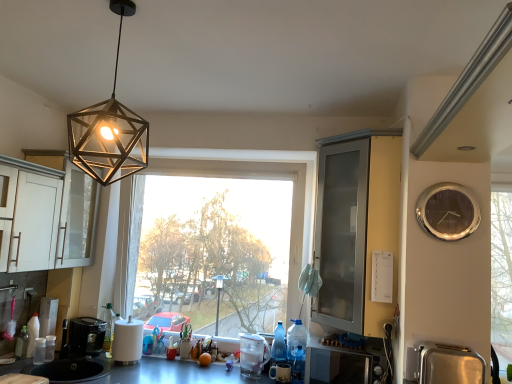
Question: Considering the relative positions of silver metallic clock at right and clear plastic blender at center, which is counted as the 3th appliance, starting from the right, in the image provided, is silver metallic clock at right in front of clear plastic blender at center, which is counted as the 3th appliance, starting from the right,?

Choices:
 (A) no
 (B) yes

Answer: (B)

Question: Does silver metallic clock at right have a lesser height compared to clear plastic blender at center, which is the second appliance in left-to-right order?

Choices:
 (A) yes
 (B) no

Answer: (B)

Question: From the image's perspective, is silver metallic clock at right on top of clear plastic blender at center, placed as the third appliance when sorted from front to back?

Choices:
 (A) yes
 (B) no

Answer: (A)

Question: Is silver metallic clock at right at the left side of clear plastic blender at center, placed as the third appliance when sorted from front to back?

Choices:
 (A) no
 (B) yes

Answer: (A)

Question: From the image's perspective, would you say silver metallic clock at right is shown under clear plastic blender at center, which is the second appliance in left-to-right order?

Choices:
 (A) no
 (B) yes

Answer: (A)

Question: Is silver metallic clock at right outside of clear plastic blender at center, which is the 2th appliance from back to front?

Choices:
 (A) no
 (B) yes

Answer: (B)

Question: From the image's perspective, is silver metallic clock at right on top of metallic gray countertop at lower center?

Choices:
 (A) yes
 (B) no

Answer: (A)

Question: Is silver metallic clock at right taller than metallic gray countertop at lower center?

Choices:
 (A) yes
 (B) no

Answer: (A)

Question: From a real-world perspective, is silver metallic clock at right beneath metallic gray countertop at lower center?

Choices:
 (A) no
 (B) yes

Answer: (A)

Question: Is silver metallic clock at right surrounding metallic gray countertop at lower center?

Choices:
 (A) yes
 (B) no

Answer: (B)

Question: From the image's perspective, is silver metallic clock at right below metallic gray countertop at lower center?

Choices:
 (A) yes
 (B) no

Answer: (B)

Question: Considering the relative sizes of silver metallic clock at right and metallic gray countertop at lower center in the image provided, is silver metallic clock at right smaller than metallic gray countertop at lower center?

Choices:
 (A) yes
 (B) no

Answer: (A)

Question: Is silver metallic clock at right shorter than metallic hexagonal light fixture at upper center?

Choices:
 (A) no
 (B) yes

Answer: (B)